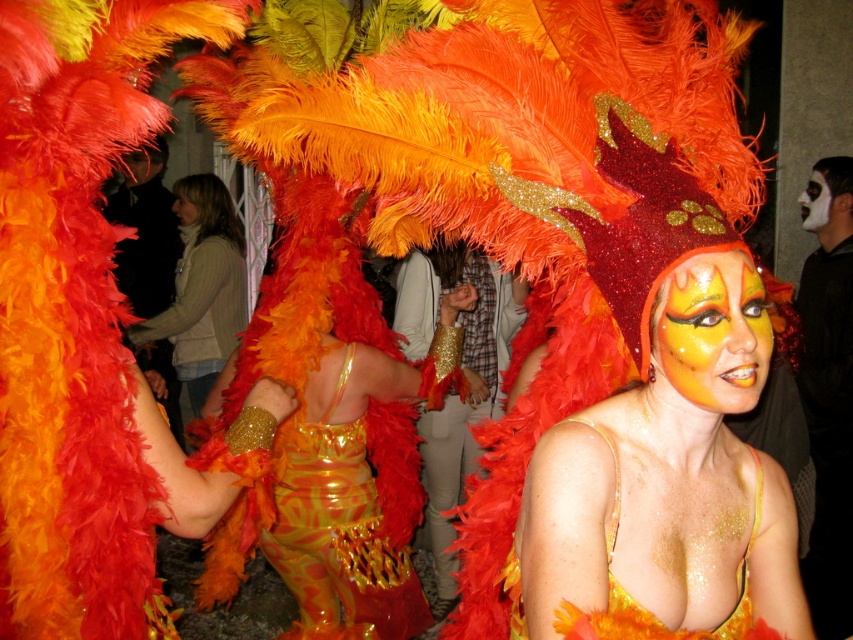
You are a makeup artist observing the image and need to determine which area on the face has a smaller width between the shiny gold face paint at center and the smooth skin face at center. Which one is it?

The shiny gold face paint at center has a lesser width compared to the smooth skin face at center, so the shiny gold face paint at center is the smaller one.

In the scene shown: You are a photographer at the carnival. You want to capture the shiny gold face paint at center in your photo. The camera you are using has a focus point at coordinate point (711, 336). Is the focus point correctly positioned to capture the shiny gold face paint at center?

Yes, the focus point at coordinate point (711, 336) is correctly positioned to capture the shiny gold face paint at center because the point indicates the location of the shiny gold face paint at center.